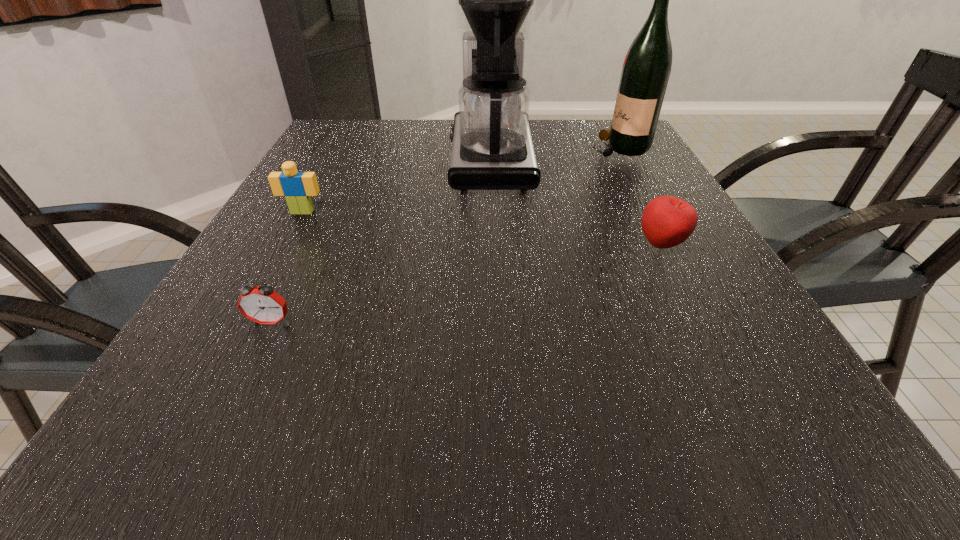
At what (x,y) coordinates should I click in order to perform the action: click on free spot between the wine bottle and the coffee maker. Please return your answer as a coordinate pair (x, y). Looking at the image, I should click on (555, 153).

Image resolution: width=960 pixels, height=540 pixels. I want to click on free point between the shortest object and the Lego, so click(x=287, y=267).

You are a GUI agent. You are given a task and a screenshot of the screen. Output one action in this format:
    pyautogui.click(x=<x>, y=<y>)
    Task: Click on the free space that is in between the second nearest object and the third object from left to right
    This screenshot has height=540, width=960.
    Given the screenshot: What is the action you would take?
    pyautogui.click(x=576, y=202)

Where is `free space between the fourth farthest object and the shortest object`? The width and height of the screenshot is (960, 540). free space between the fourth farthest object and the shortest object is located at coordinates (467, 283).

The height and width of the screenshot is (540, 960). I want to click on free space between the Lego and the coffee maker, so click(x=396, y=186).

Locate which object ranks third in proximity to the third object from right to left. Please provide its 2D coordinates. Your answer should be formatted as a tuple, i.e. [(x, y)], where the tuple contains the x and y coordinates of a point satisfying the conditions above.

[(297, 187)]

Select which object is the second closest to the wine bottle. Please provide its 2D coordinates. Your answer should be formatted as a tuple, i.e. [(x, y)], where the tuple contains the x and y coordinates of a point satisfying the conditions above.

[(667, 221)]

Where is `free spot that satisfies the following two spatial constraints: 1. on the back side of the wine bottle; 2. on the right side of the apple`? This screenshot has width=960, height=540. free spot that satisfies the following two spatial constraints: 1. on the back side of the wine bottle; 2. on the right side of the apple is located at coordinates (612, 147).

What are the coordinates of `free spot that satisfies the following two spatial constraints: 1. on the back side of the fourth farthest object; 2. at the front of the coffee maker where the controls are located` in the screenshot? It's located at (617, 159).